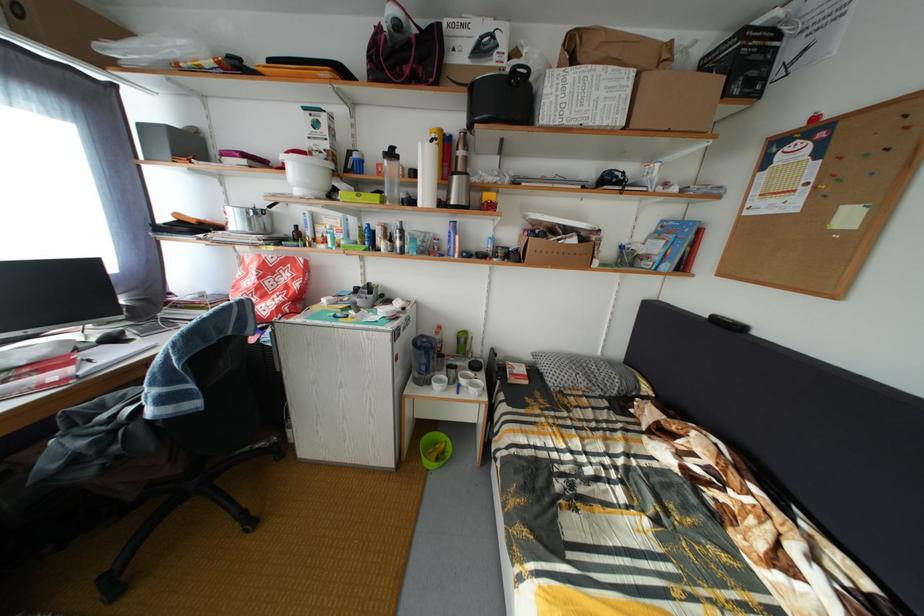
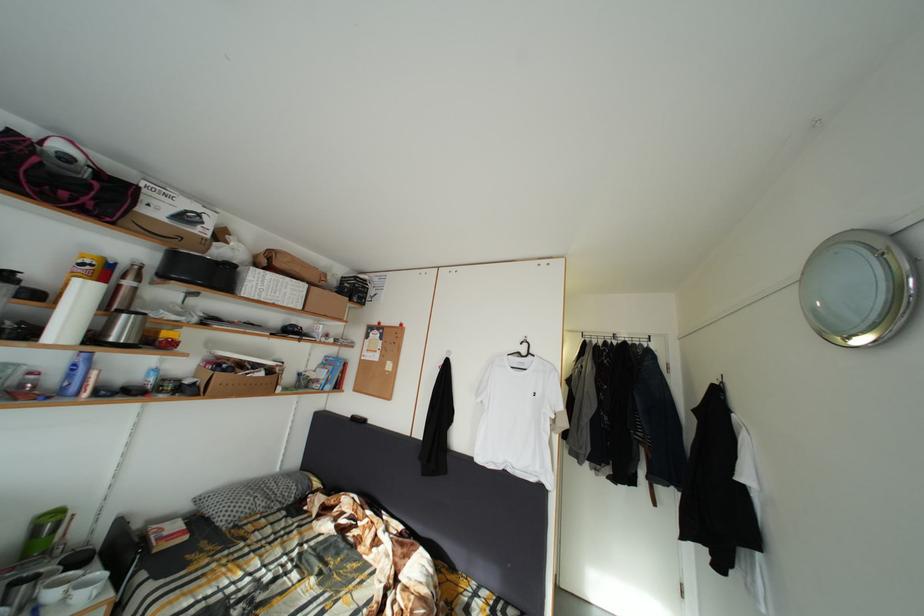
In the second image, find the point that corresponds to the point at 441,148 in the first image.

(91, 270)